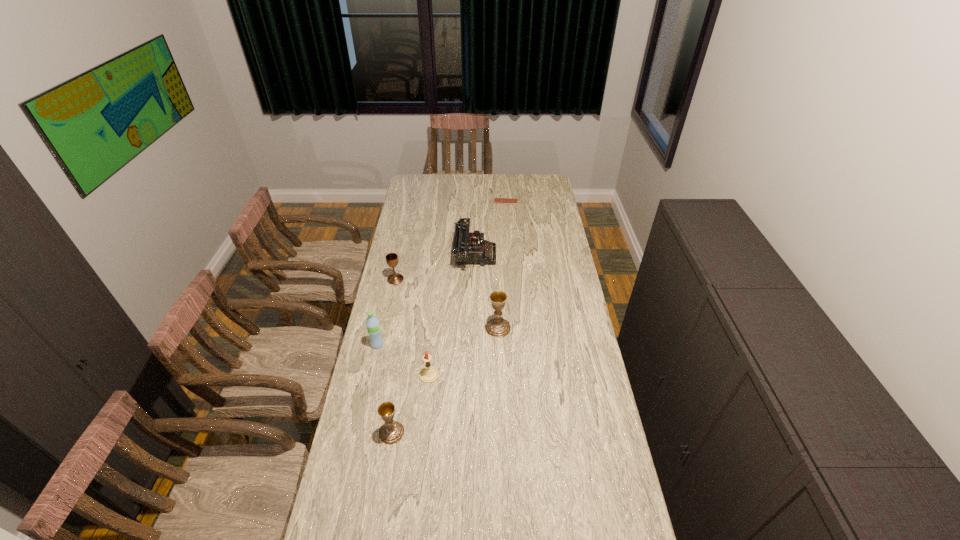
Image resolution: width=960 pixels, height=540 pixels. What are the coordinates of `vacant spot to place a chalice on the right` in the screenshot? It's located at (570, 256).